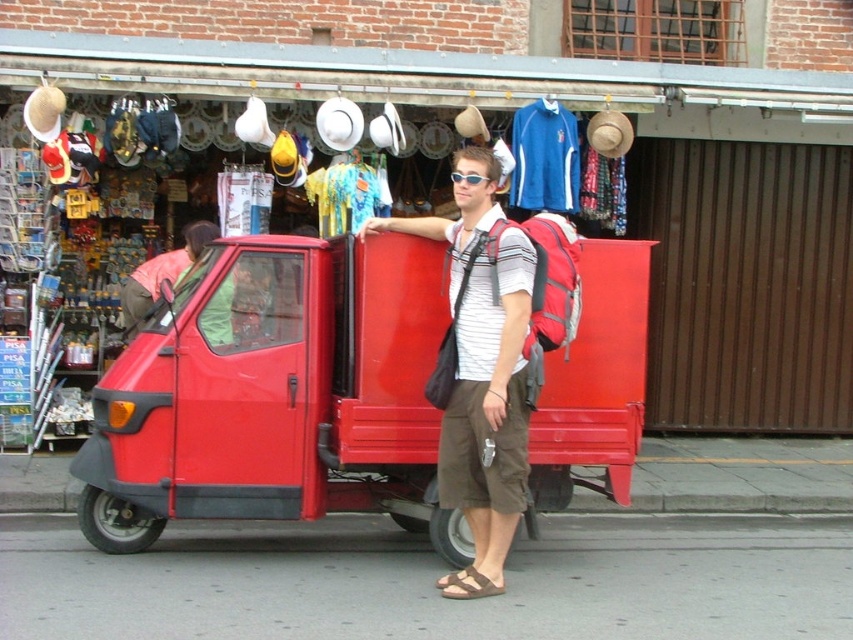
Question: Is matte red scooter at center below sunglasses at center?

Choices:
 (A) yes
 (B) no

Answer: (A)

Question: Does matte red scooter at center appear over matte green shirt at center?

Choices:
 (A) yes
 (B) no

Answer: (B)

Question: Is red matte/metallic food truck at center above sunglasses at center?

Choices:
 (A) yes
 (B) no

Answer: (B)

Question: Among these objects, which one is farthest from the camera?

Choices:
 (A) matte red scooter at center
 (B) red matte/metallic food truck at center

Answer: (B)

Question: Which of these objects is positioned closest to the red matte/metallic food truck at center?

Choices:
 (A) sunglasses at center
 (B) matte red scooter at center
 (C) matte green shirt at center

Answer: (B)

Question: Which object is farther from the camera taking this photo?

Choices:
 (A) matte green shirt at center
 (B) matte red scooter at center
 (C) red matte/metallic food truck at center

Answer: (A)